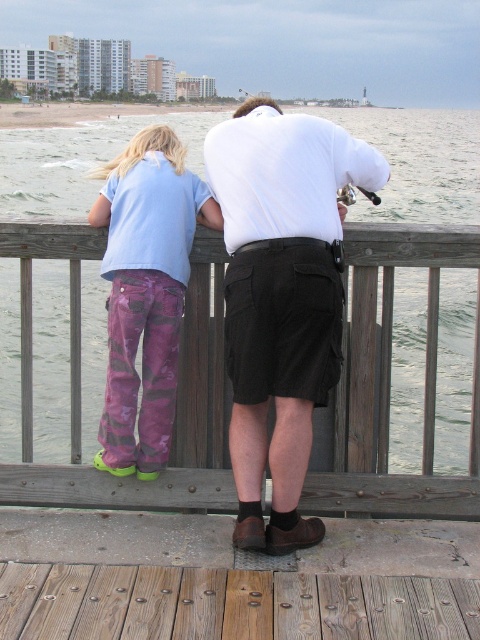
Question: Which point appears closest to the camera in this image?

Choices:
 (A) (58, 221)
 (B) (385, 627)
 (C) (156, 467)

Answer: (B)

Question: Observing the image, what is the correct spatial positioning of light blue cotton shirt at center in reference to wooden rail at center?

Choices:
 (A) right
 (B) left

Answer: (B)

Question: Estimate the real-world distances between objects in this image. Which object is closer to the light blue cotton shirt at center?

Choices:
 (A) wooden planks at lower center
 (B) wooden rail at center

Answer: (B)

Question: Does light blue cotton shirt at center come behind wooden planks at lower center?

Choices:
 (A) yes
 (B) no

Answer: (A)

Question: Can you confirm if wooden rail at center is thinner than camouflage pants at left?

Choices:
 (A) no
 (B) yes

Answer: (A)

Question: Which point appears farthest from the camera in this image?

Choices:
 (A) (304, 637)
 (B) (156, 324)
 (C) (373, 253)

Answer: (C)